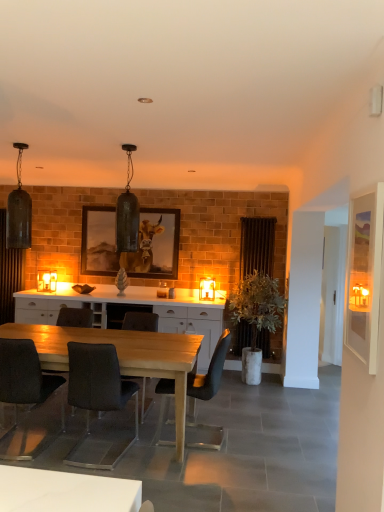
Question: Can you confirm if matte glass candle at center, which is counted as the 1th lamp, starting from the left, is shorter than matte black pendant light at upper left, the second lamp when ordered from left to right?

Choices:
 (A) no
 (B) yes

Answer: (B)

Question: Is matte glass candle at center, which is counted as the 1th lamp, starting from the left, to the left of matte black pendant light at upper left, marked as the third lamp in a right-to-left arrangement, from the viewer's perspective?

Choices:
 (A) no
 (B) yes

Answer: (B)

Question: Does matte glass candle at center, which is counted as the 1th lamp, starting from the left, have a greater width compared to matte black pendant light at upper left, the 2th lamp viewed from the front?

Choices:
 (A) no
 (B) yes

Answer: (A)

Question: Does matte glass candle at center, arranged as the fourth lamp when viewed from the right, have a smaller size compared to matte black pendant light at upper left, acting as the third lamp starting from the back?

Choices:
 (A) no
 (B) yes

Answer: (B)

Question: Considering the relative sizes of matte glass candle at center, which is counted as the 1th lamp, starting from the left, and matte black pendant light at upper left, marked as the third lamp in a right-to-left arrangement, in the image provided, is matte glass candle at center, which is counted as the 1th lamp, starting from the left, taller than matte black pendant light at upper left, marked as the third lamp in a right-to-left arrangement,?

Choices:
 (A) yes
 (B) no

Answer: (B)

Question: From a real-world perspective, is matte glass candle at center, which is counted as the 1th lamp, starting from the left, over matte black pendant light at upper left, marked as the third lamp in a right-to-left arrangement?

Choices:
 (A) no
 (B) yes

Answer: (A)

Question: Is dark gray fabric chair at lower left, which appears as the 4th chair when viewed from the right, positioned with its back to dark gray fabric chair at center, the 3th chair viewed from the right?

Choices:
 (A) no
 (B) yes

Answer: (A)

Question: From a real-world perspective, does dark gray fabric chair at lower left, which appears as the 4th chair when viewed from the right, sit lower than dark gray fabric chair at center, marked as the second chair in a left-to-right arrangement?

Choices:
 (A) no
 (B) yes

Answer: (A)

Question: Can you confirm if dark gray fabric chair at lower left, which ranks as the first chair in left-to-right order, is smaller than dark gray fabric chair at center, marked as the second chair in a left-to-right arrangement?

Choices:
 (A) no
 (B) yes

Answer: (B)

Question: Is dark gray fabric chair at lower left, which appears as the 4th chair when viewed from the right, positioned in front of dark gray fabric chair at center, the 3th chair viewed from the right?

Choices:
 (A) no
 (B) yes

Answer: (A)

Question: Is dark gray fabric chair at lower left, which ranks as the first chair in left-to-right order, completely or partially outside of dark gray fabric chair at center, the 3th chair viewed from the right?

Choices:
 (A) no
 (B) yes

Answer: (B)

Question: Is dark gray fabric chair at lower left, which ranks as the first chair in left-to-right order, far from dark gray fabric chair at center, marked as the second chair in a left-to-right arrangement?

Choices:
 (A) no
 (B) yes

Answer: (A)

Question: Is the position of dark gray fabric chair at center, marked as the second chair in a left-to-right arrangement, more distant than that of wooden framed picture of cow at center?

Choices:
 (A) no
 (B) yes

Answer: (A)